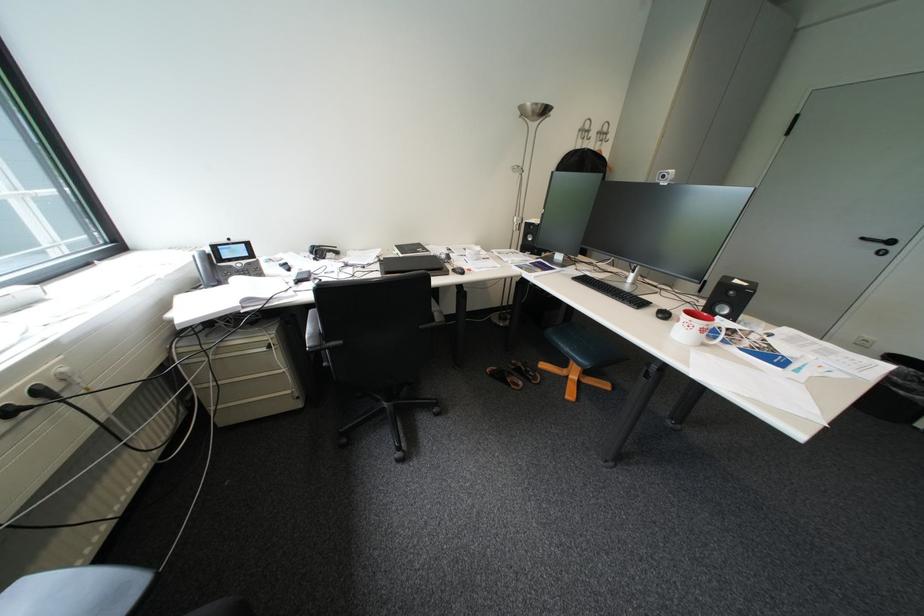
The image size is (924, 616). Describe the element at coordinates (880, 233) in the screenshot. I see `the black door handle` at that location.